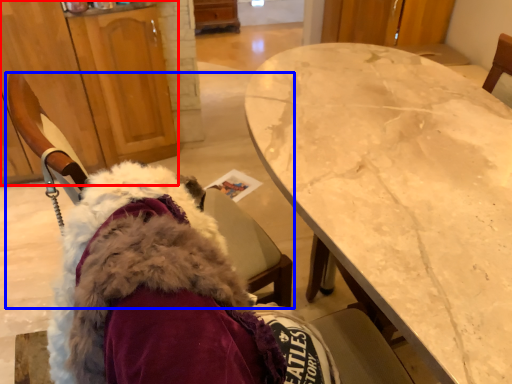
Question: Which point is further to the camera, cabinetry (highlighted by a red box) or chair (highlighted by a blue box)?

Choices:
 (A) cabinetry
 (B) chair

Answer: (A)